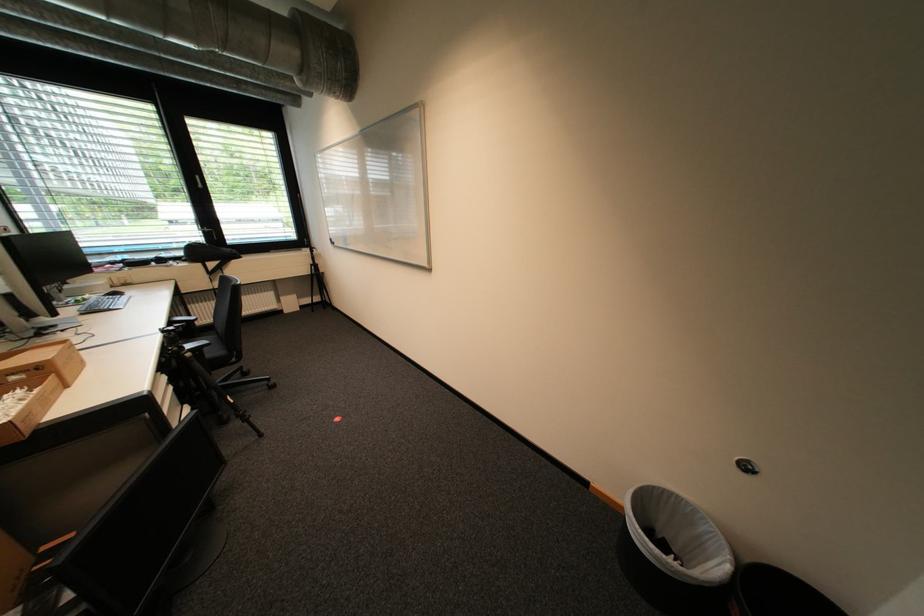
The location [33,385] corresponds to which object?

It corresponds to the cardboard box in the image.